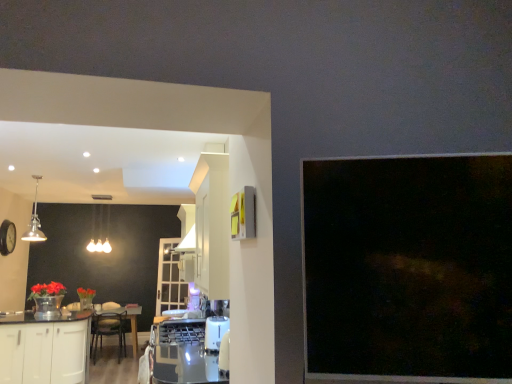
Question: Is clear glass door at center far away from wooden round table at center?

Choices:
 (A) no
 (B) yes

Answer: (A)

Question: Is wooden round table at center a part of clear glass door at center?

Choices:
 (A) yes
 (B) no

Answer: (B)

Question: Can you confirm if clear glass door at center is bigger than wooden round table at center?

Choices:
 (A) yes
 (B) no

Answer: (B)

Question: Is clear glass door at center oriented away from wooden round table at center?

Choices:
 (A) no
 (B) yes

Answer: (A)

Question: Is clear glass door at center wider than wooden round table at center?

Choices:
 (A) yes
 (B) no

Answer: (B)

Question: Is clear glass door at center placed right next to wooden round table at center?

Choices:
 (A) no
 (B) yes

Answer: (A)

Question: Is wooden round table at center oriented towards white glossy cabinetry at lower left?

Choices:
 (A) yes
 (B) no

Answer: (A)

Question: Is wooden round table at center positioned in front of white glossy cabinetry at lower left?

Choices:
 (A) no
 (B) yes

Answer: (A)

Question: Is the position of wooden round table at center more distant than that of white glossy cabinetry at lower left?

Choices:
 (A) no
 (B) yes

Answer: (B)

Question: Does wooden round table at center appear on the right side of white glossy cabinetry at lower left?

Choices:
 (A) yes
 (B) no

Answer: (A)

Question: Is white glossy cabinetry at lower left located within wooden round table at center?

Choices:
 (A) yes
 (B) no

Answer: (B)

Question: From the image's perspective, is wooden round table at center over white glossy cabinetry at lower left?

Choices:
 (A) no
 (B) yes

Answer: (A)

Question: Does wooden round table at center have a lesser width compared to clear glass door at center?

Choices:
 (A) no
 (B) yes

Answer: (A)